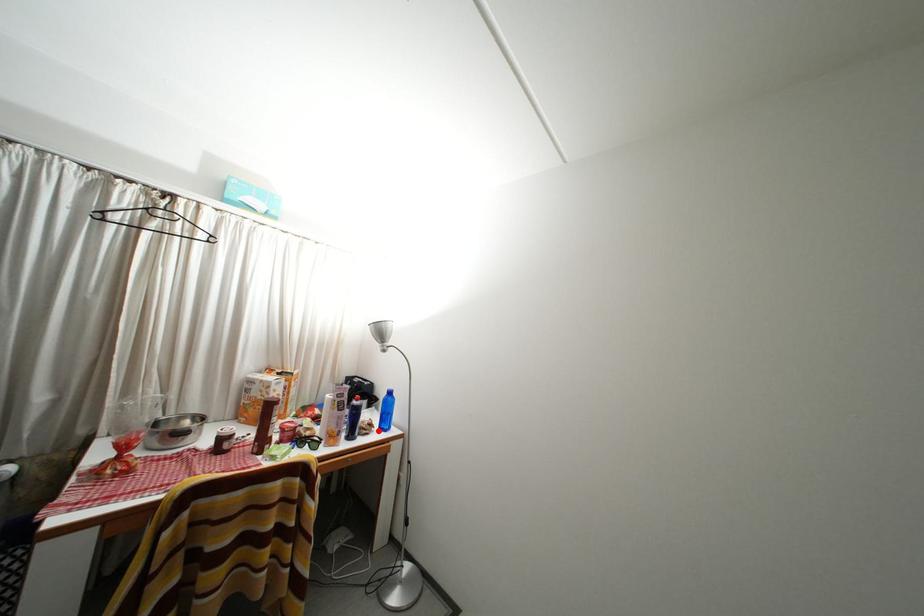
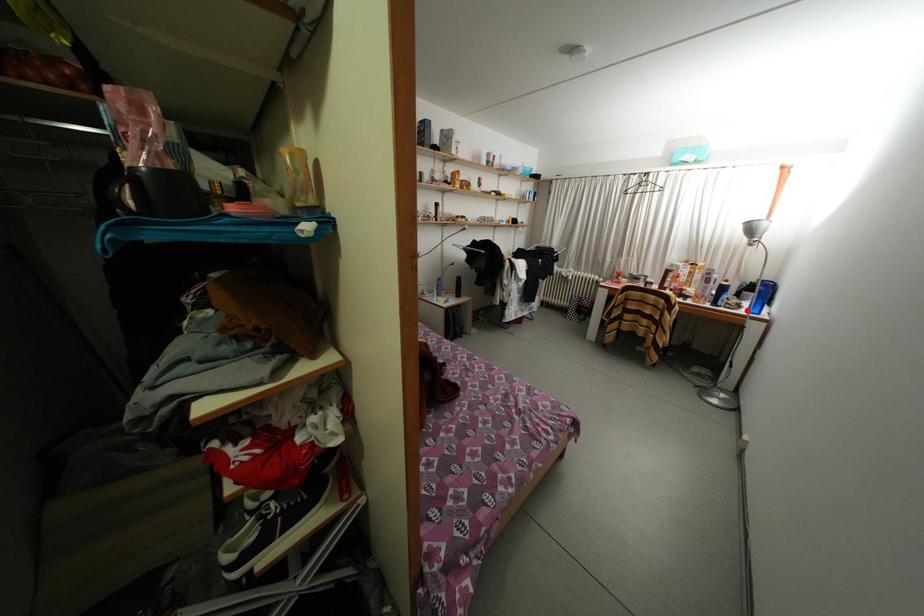
I am providing you with two images of the same scene from different viewpoints. A red point is marked on the first image and another point is marked on the second image. Are the points marked in image1 and image2 representing the same 3D position?

Yes